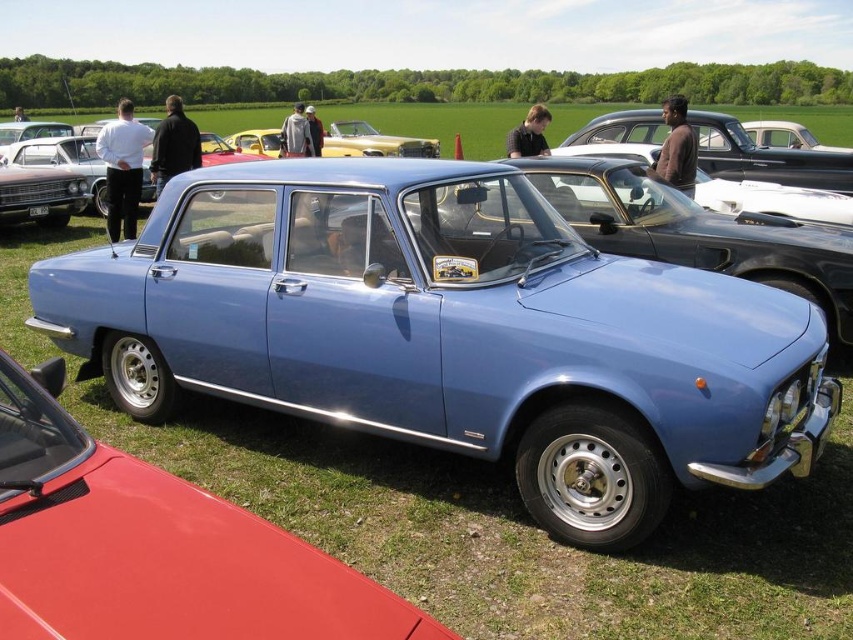
Question: Which is nearer to the gold metallic vintage car at center?

Choices:
 (A) matte blue sedan at center
 (B) matte blue car at center

Answer: (A)

Question: Can you confirm if matte blue car at center is wider than metallic blue sedan at center?

Choices:
 (A) no
 (B) yes

Answer: (B)

Question: Which of the following is the closest to the observer?

Choices:
 (A) metallic blue sedan at center
 (B) gold metallic vintage car at center
 (C) matte blue car at center
 (D) matte blue sedan at center

Answer: (A)

Question: Is matte blue car at center smaller than metallic blue sedan at center?

Choices:
 (A) yes
 (B) no

Answer: (B)

Question: Is matte blue car at center smaller than matte blue sedan at center?

Choices:
 (A) yes
 (B) no

Answer: (A)

Question: Which object is closer to the camera taking this photo?

Choices:
 (A) matte blue car at center
 (B) gold metallic vintage car at center
 (C) matte blue sedan at center

Answer: (A)